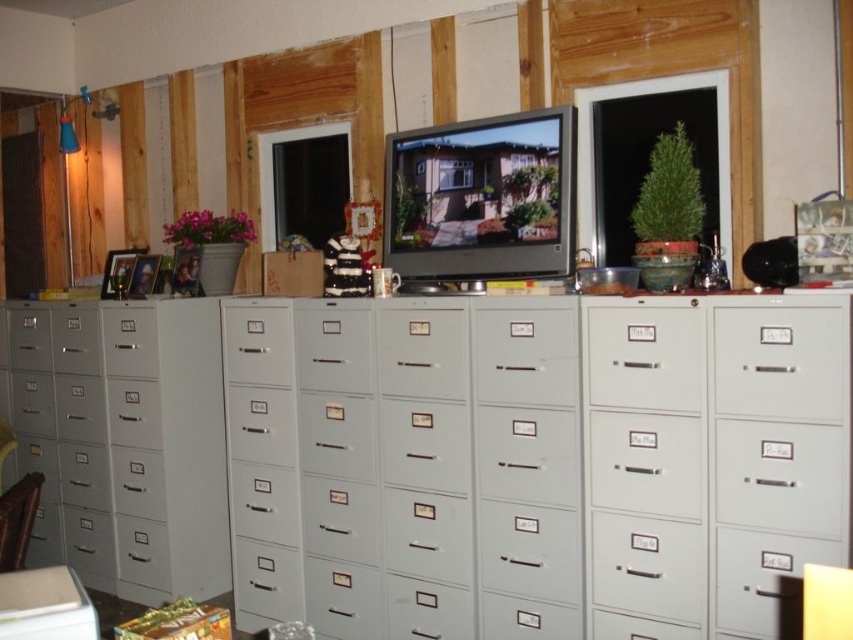
You are standing in a room with a row of gray filing cabinets. There is a point marked at coordinates [556,467]. What object is located at that point?

The point at coordinates [556,467] marks the gray metal file cabinet at center.

You are standing in front of the row of gray filing cabinets and see two points marked in the room. The first point is at coordinate point (277, 308) and the second is at point (105, 360). If you want to move from the first point to the second point, which direction should you move relative to the second point?

To move from point (277, 308) to point (105, 360), you should move towards the direction of the second point, which is behind the first point since point (277, 308) is in front of point (105, 360).